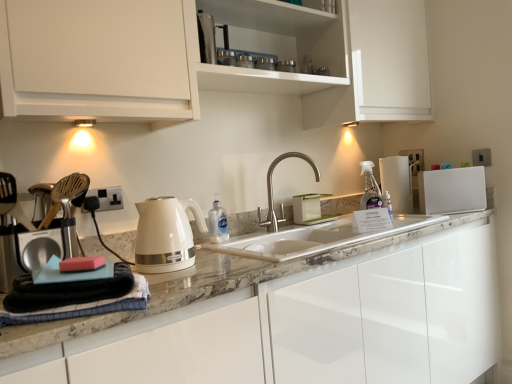
Image resolution: width=512 pixels, height=384 pixels. I want to click on vacant area that lies to the right of white glossy electric kettle at center-left, so [226, 265].